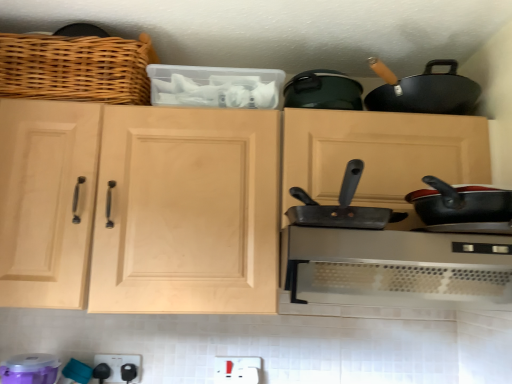
Question: From the image's perspective, is black plastic outlet at lower center, the 2th appliance when ordered from front to back, over purple plastic container at lower left, marked as the first appliance in a left-to-right arrangement?

Choices:
 (A) no
 (B) yes

Answer: (A)

Question: Is purple plastic container at lower left, which is the 2th appliance in right-to-left order, completely or partially inside black plastic outlet at lower center, the 2th appliance when ordered from front to back?

Choices:
 (A) yes
 (B) no

Answer: (B)

Question: Is black plastic outlet at lower center, arranged as the 2th appliance when viewed from the left, far away from purple plastic container at lower left, marked as the first appliance in a left-to-right arrangement?

Choices:
 (A) yes
 (B) no

Answer: (B)

Question: Can you confirm if black plastic outlet at lower center, arranged as the first appliance when viewed from the right, is smaller than purple plastic container at lower left, marked as the first appliance in a left-to-right arrangement?

Choices:
 (A) yes
 (B) no

Answer: (A)

Question: Is purple plastic container at lower left, which is the 2th appliance in right-to-left order, at the back of black plastic outlet at lower center, which is counted as the 1th appliance, starting from the back?

Choices:
 (A) no
 (B) yes

Answer: (A)

Question: Can we say black plastic outlet at lower center, arranged as the 2th appliance when viewed from the left, lies outside purple plastic container at lower left, which is the 2th appliance in right-to-left order?

Choices:
 (A) yes
 (B) no

Answer: (A)

Question: Considering the relative positions of natural wood cabinet at center and woven wood basket at upper left in the image provided, is natural wood cabinet at center to the left of woven wood basket at upper left from the viewer's perspective?

Choices:
 (A) no
 (B) yes

Answer: (A)

Question: Considering the relative positions of natural wood cabinet at center and woven wood basket at upper left in the image provided, is natural wood cabinet at center in front of woven wood basket at upper left?

Choices:
 (A) no
 (B) yes

Answer: (B)

Question: Is natural wood cabinet at center with woven wood basket at upper left?

Choices:
 (A) no
 (B) yes

Answer: (A)

Question: Can you confirm if natural wood cabinet at center is wider than woven wood basket at upper left?

Choices:
 (A) yes
 (B) no

Answer: (A)

Question: Is natural wood cabinet at center positioned far away from woven wood basket at upper left?

Choices:
 (A) yes
 (B) no

Answer: (B)

Question: Is natural wood cabinet at center oriented away from woven wood basket at upper left?

Choices:
 (A) yes
 (B) no

Answer: (B)

Question: Can you confirm if natural wood cabinet at center is thinner than purple plastic container at lower left, marked as the first appliance in a left-to-right arrangement?

Choices:
 (A) no
 (B) yes

Answer: (A)